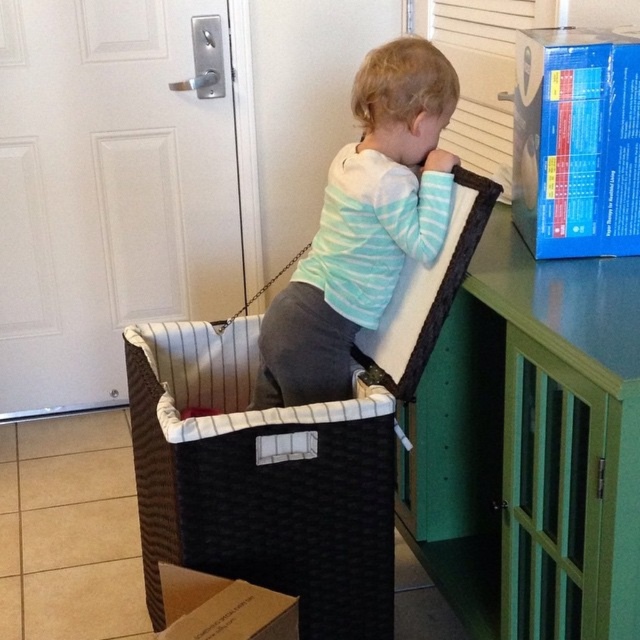
You are standing at the point labeled point (525, 51) and want to walk to the point labeled point (180, 566). Given the scene described, will you be moving towards the door or away from it?

Since point (525, 51) is behind point (180, 566), moving from point (525, 51) to point (180, 566) means you are moving forward towards the door.

You are a photographer standing in front of the black woven basket at center. You want to take a photo of the basket but need to ensure you are within the recommended 1.5 meters distance for optimal focus. Are you within the safe distance?

The distance between you and the black woven basket at center is 1.36 meters, which is within the recommended 1.5 meters for optimal focus. You are within the safe distance.